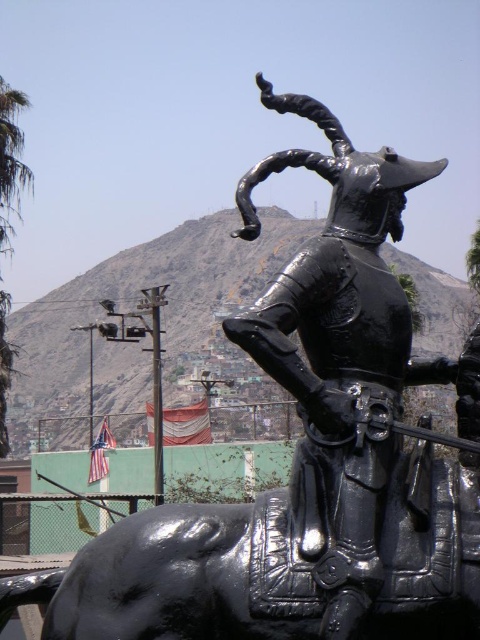
You are an artist trying to sketch this scene. You want to ensure the glossy black armor at center and the green leafy palm tree at left are proportionally accurate. Which object should you draw first to maintain the correct size relationship between them?

You should draw the green leafy palm tree at left first because the glossy black armor at center occupies less space, meaning the palm tree is larger and should be sketched first to establish the correct proportions.

You are an observer standing in front of the statue. You notice the glossy black armor at center and the green leafy palm tree at left. Which object is closer to you?

The glossy black armor at center is closer to you because it is in front of the green leafy palm tree at left.

You are a tourist standing in front of the statue and want to take a photo that includes both the glossy black armor at center and the green leafy palm tree at left. Based on their heights, which object should appear smaller in the photo?

The glossy black armor at center is shorter than the green leafy palm tree at left, so it should appear smaller in the photo.